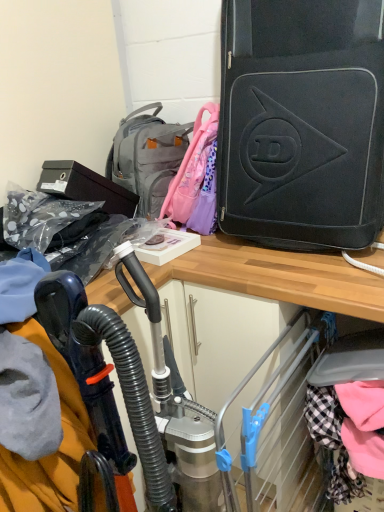
The height and width of the screenshot is (512, 384). In order to click on vacant area that is in front of black matte suitcase at upper right in this screenshot , I will do `click(316, 274)`.